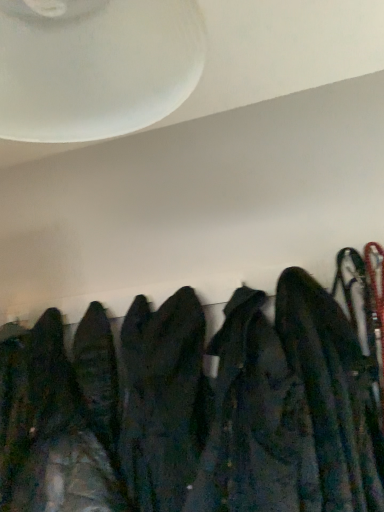
This screenshot has width=384, height=512. What do you see at coordinates (333, 393) in the screenshot? I see `dark blue fabric jacket at right` at bounding box center [333, 393].

I want to click on dark blue fabric jacket at right, so click(x=333, y=393).

This screenshot has height=512, width=384. Describe the element at coordinates (95, 66) in the screenshot. I see `white frosted glass fan at upper center` at that location.

I want to click on white frosted glass fan at upper center, so click(x=95, y=66).

What are the coordinates of `dark blue fabric jacket at right` in the screenshot? It's located at (333, 393).

Can you confirm if white frosted glass fan at upper center is positioned to the left of dark blue fabric jacket at right?

Yes.

Who is more distant, white frosted glass fan at upper center or dark blue fabric jacket at right?

dark blue fabric jacket at right is further away from the camera.

Which point is more distant from viewer, [120,112] or [367,473]?

The point [367,473] is more distant.

From the image's perspective, is white frosted glass fan at upper center located above dark blue fabric jacket at right?

Correct, white frosted glass fan at upper center appears higher than dark blue fabric jacket at right in the image.

From a real-world perspective, is white frosted glass fan at upper center positioned above or below dark blue fabric jacket at right?

Clearly, from a real-world perspective, white frosted glass fan at upper center is above dark blue fabric jacket at right.

Based on the photo, is white frosted glass fan at upper center wider than dark blue fabric jacket at right?

Incorrect, the width of white frosted glass fan at upper center does not surpass that of dark blue fabric jacket at right.

Between white frosted glass fan at upper center and dark blue fabric jacket at right, which one has less height?

With less height is white frosted glass fan at upper center.

Can you confirm if white frosted glass fan at upper center is smaller than dark blue fabric jacket at right?

Indeed, white frosted glass fan at upper center has a smaller size compared to dark blue fabric jacket at right.

Is white frosted glass fan at upper center located outside dark blue fabric jacket at right?

Yes, white frosted glass fan at upper center is located beyond the bounds of dark blue fabric jacket at right.

Are white frosted glass fan at upper center and dark blue fabric jacket at right located far from each other?

No, there isn't a large distance between white frosted glass fan at upper center and dark blue fabric jacket at right.

Could you tell me if white frosted glass fan at upper center is facing dark blue fabric jacket at right?

No.

Where is `fan above the dark blue fabric jacket at right (from the image's perspective)`? The image size is (384, 512). fan above the dark blue fabric jacket at right (from the image's perspective) is located at coordinates (95, 66).

Between dark blue fabric jacket at right and white frosted glass fan at upper center, which one appears on the left side from the viewer's perspective?

Positioned to the left is white frosted glass fan at upper center.

Consider the image. Is the depth of dark blue fabric jacket at right less than that of white frosted glass fan at upper center?

No, it is behind white frosted glass fan at upper center.

Between point (351, 499) and point (16, 53), which one is positioned in front?

The point (16, 53) is in front.

From the image's perspective, which is below, dark blue fabric jacket at right or white frosted glass fan at upper center?

dark blue fabric jacket at right is shown below in the image.

From a real-world perspective, which is physically above, dark blue fabric jacket at right or white frosted glass fan at upper center?

In real-world perspective, white frosted glass fan at upper center is above.

Looking at this image, which of these two, dark blue fabric jacket at right or white frosted glass fan at upper center, is thinner?

white frosted glass fan at upper center.

In terms of height, does dark blue fabric jacket at right look taller or shorter compared to white frosted glass fan at upper center?

Clearly, dark blue fabric jacket at right is taller compared to white frosted glass fan at upper center.

Can you confirm if dark blue fabric jacket at right is smaller than white frosted glass fan at upper center?

No.

Is dark blue fabric jacket at right located outside white frosted glass fan at upper center?

Indeed, dark blue fabric jacket at right is completely outside white frosted glass fan at upper center.

Are dark blue fabric jacket at right and white frosted glass fan at upper center far apart?

dark blue fabric jacket at right is near white frosted glass fan at upper center, not far away.

Is dark blue fabric jacket at right positioned with its back to white frosted glass fan at upper center?

No, white frosted glass fan at upper center is not at the back of dark blue fabric jacket at right.

Where is `jacket below the white frosted glass fan at upper center (from a real-world perspective)`? This screenshot has width=384, height=512. jacket below the white frosted glass fan at upper center (from a real-world perspective) is located at coordinates tap(333, 393).

This screenshot has height=512, width=384. I want to click on fan in front of the dark blue fabric jacket at right, so click(95, 66).

Where is `fan on the left of dark blue fabric jacket at right`? fan on the left of dark blue fabric jacket at right is located at coordinates (95, 66).